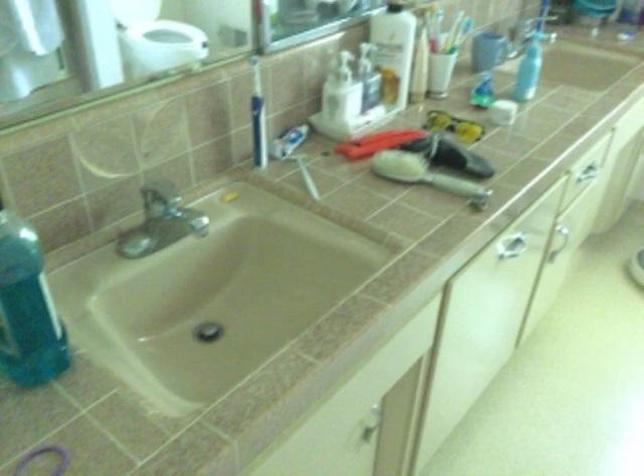
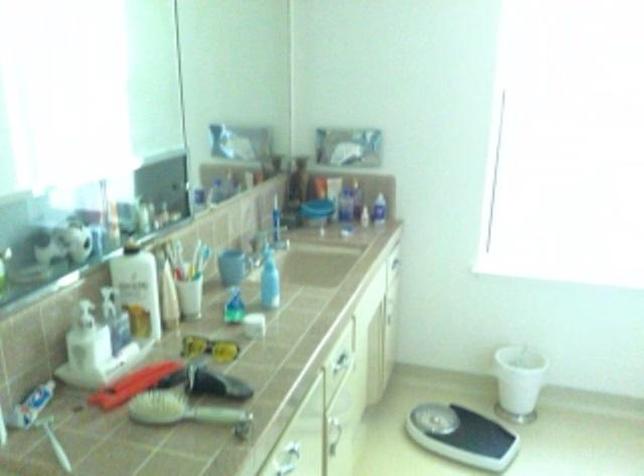
The point at (516, 249) is marked in the first image. Where is the corresponding point in the second image?

(290, 455)